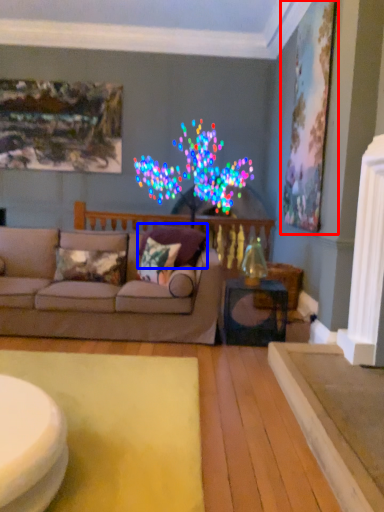
Question: Which point is further to the camera, picture frame (highlighted by a red box) or pillow (highlighted by a blue box)?

Choices:
 (A) picture frame
 (B) pillow

Answer: (A)